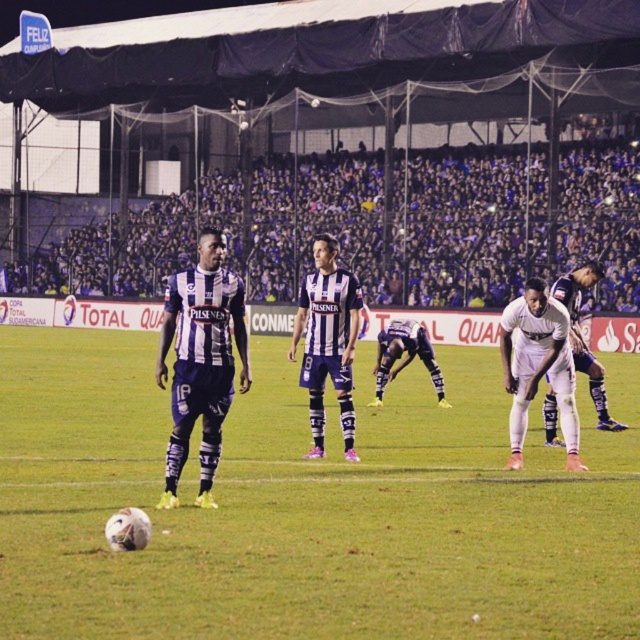
Question: Considering the relative positions of white matte uniform at center and dark blue jersey at center in the image provided, where is white matte uniform at center located with respect to dark blue jersey at center?

Choices:
 (A) left
 (B) right

Answer: (B)

Question: Is dark blue striped jersey at center smaller than white matte soccer player at center?

Choices:
 (A) yes
 (B) no

Answer: (A)

Question: Is striped jersey player at center closer to camera compared to dark blue jersey at center?

Choices:
 (A) yes
 (B) no

Answer: (A)

Question: Considering the real-world distances, which object is farthest from the dark blue striped jersey at center?

Choices:
 (A) green grass football field at center
 (B) dark blue jersey at center
 (C) purple striped jersey at center

Answer: (B)

Question: Among these objects, which one is nearest to the camera?

Choices:
 (A) white matte soccer player at center
 (B) dark blue striped jersey at center
 (C) striped jersey player at center
 (D) purple striped jersey at center

Answer: (B)

Question: Which of the following is the closest to the observer?

Choices:
 (A) (602, 419)
 (B) (314, 404)
 (C) (188, 394)
 (D) (556, 300)

Answer: (C)